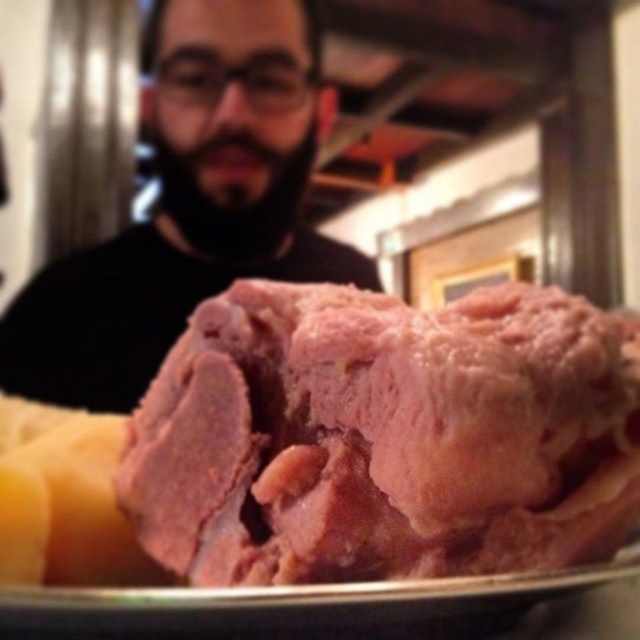
Which is more to the left, pink raw meat at center or bearded man at upper left?

From the viewer's perspective, bearded man at upper left appears more on the left side.

Is pink raw meat at center below bearded man at upper left?

Indeed, pink raw meat at center is positioned under bearded man at upper left.

Is point (259, 545) less distant than point (340, 280)?

Yes, it is.

Identify the location of pink raw meat at center. (385, 436).